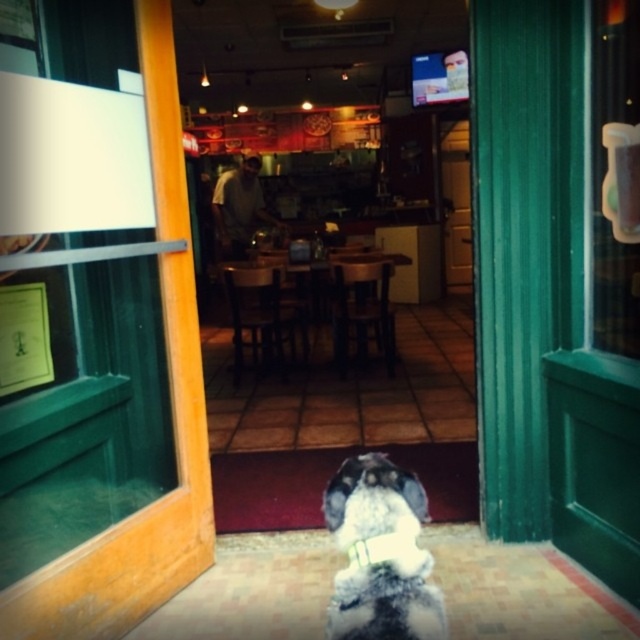
Question: Does green wood door at center have a lesser width compared to green wooden door at center?

Choices:
 (A) yes
 (B) no

Answer: (A)

Question: Observing the image, what is the correct spatial positioning of transparent plastic cup at upper right in reference to green wooden door at center?

Choices:
 (A) above
 (B) below

Answer: (B)

Question: Among these points, which one is farthest from the camera?

Choices:
 (A) (360, 618)
 (B) (445, 136)
 (C) (364, 561)
 (D) (145, 554)

Answer: (B)

Question: Which object is the closest to the white fluffy dog at center?

Choices:
 (A) green wood door at center
 (B) transparent plastic cup at upper right
 (C) white fabric neckband at center
 (D) green wooden door at center

Answer: (C)

Question: Is white fluffy dog at center above white fabric neckband at center?

Choices:
 (A) yes
 (B) no

Answer: (B)

Question: Which point is farther to the camera?

Choices:
 (A) green wooden door at center
 (B) white fluffy dog at center
 (C) white fabric neckband at center
 (D) green wood door at center

Answer: (A)